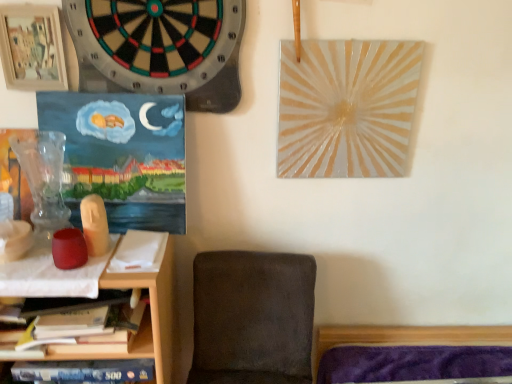
Question: Are wooden picture frame at upper left and wooden shelf at lower left located far from each other?

Choices:
 (A) no
 (B) yes

Answer: (A)

Question: Does wooden picture frame at upper left lie in front of wooden shelf at lower left?

Choices:
 (A) yes
 (B) no

Answer: (B)

Question: Does wooden picture frame at upper left have a lesser width compared to wooden shelf at lower left?

Choices:
 (A) no
 (B) yes

Answer: (B)

Question: From a real-world perspective, is wooden picture frame at upper left physically below wooden shelf at lower left?

Choices:
 (A) no
 (B) yes

Answer: (A)

Question: Considering the relative sizes of wooden picture frame at upper left and wooden shelf at lower left in the image provided, is wooden picture frame at upper left shorter than wooden shelf at lower left?

Choices:
 (A) yes
 (B) no

Answer: (A)

Question: From a real-world perspective, is wooden picture frame at upper left positioned over wooden shelf at lower left based on gravity?

Choices:
 (A) no
 (B) yes

Answer: (B)

Question: Does dark gray fabric chair at lower center have a lesser width compared to wooden shelf at lower left?

Choices:
 (A) yes
 (B) no

Answer: (B)

Question: Does dark gray fabric chair at lower center have a greater height compared to wooden shelf at lower left?

Choices:
 (A) no
 (B) yes

Answer: (A)

Question: Is the position of dark gray fabric chair at lower center less distant than that of wooden shelf at lower left?

Choices:
 (A) no
 (B) yes

Answer: (B)

Question: Does dark gray fabric chair at lower center appear on the right side of wooden shelf at lower left?

Choices:
 (A) yes
 (B) no

Answer: (A)

Question: From a real-world perspective, is dark gray fabric chair at lower center under wooden shelf at lower left?

Choices:
 (A) no
 (B) yes

Answer: (B)

Question: Does dark gray fabric chair at lower center appear on the left side of wooden shelf at lower left?

Choices:
 (A) yes
 (B) no

Answer: (B)

Question: Does wooden picture frame at upper left come in front of black felt dartboard at upper left?

Choices:
 (A) no
 (B) yes

Answer: (A)